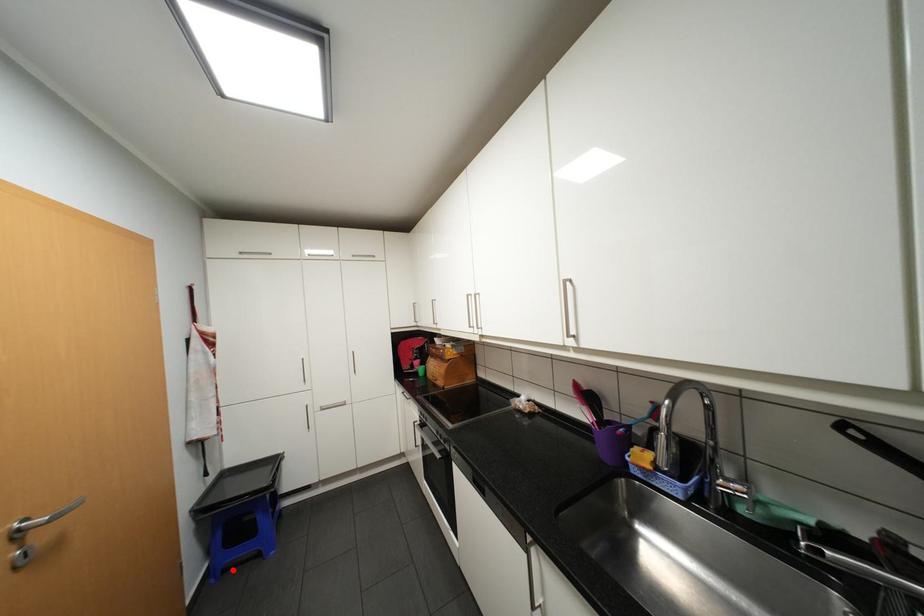
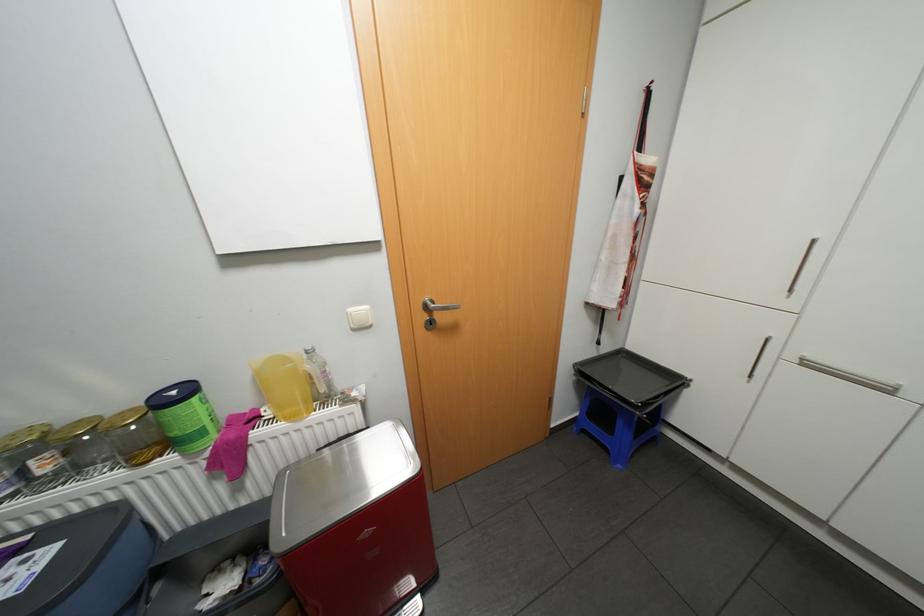
Where in the second image is the point corresponding to the highlighted location from the first image?

(591, 431)